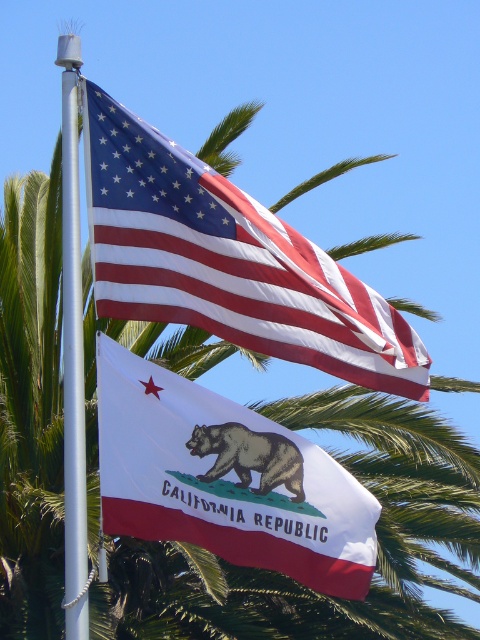
You are a photographer trying to capture both the white fabric flag at center and the white metallic pole at left in your shot. However, the pole is blocking part of the flag. Based on their positions, can you adjust your camera angle to ensure the entire flag is visible without the pole covering it?

The white fabric flag at center is positioned under the white metallic pole at left, so adjusting the camera angle downward might allow the entire flag to be visible without the pole obstructing it.

You are standing in front of two flags on a pole. The matte cotton flag at upper center and another flag below it. Which flag is positioned higher on the pole?

The matte cotton flag at upper center is positioned higher on the pole as it is located at point 0.473 vertically, which is higher than the other flag below it.

You are standing in front of two flags displayed against a clear blue sky. You see the white fabric flag at center and the white metallic pole at left. Which object is positioned to the right of the other?

The white fabric flag at center is to the right of the white metallic pole at left.